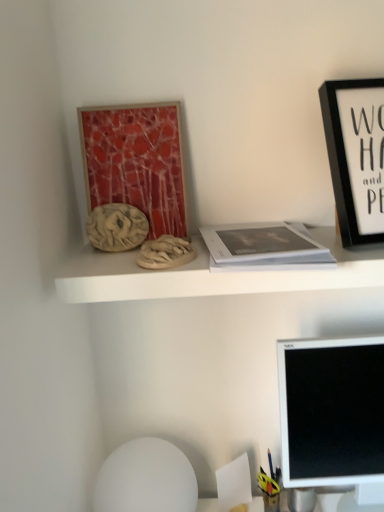
You are a GUI agent. You are given a task and a screenshot of the screen. Output one action in this format:
    pyautogui.click(x=<x>, y=<y>)
    Task: Click on the free space above white matte book at center (from a real-world perspective)
    
    Given the screenshot: What is the action you would take?
    pyautogui.click(x=259, y=241)